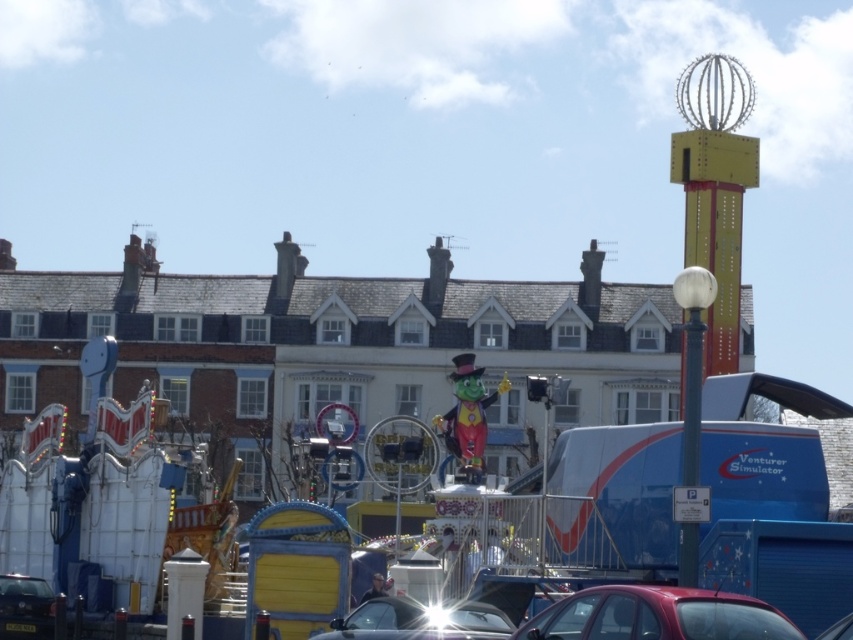
You are a photographer trying to capture a clear shot of the carnival ride in the background. You have two cars in your frame, the shiny red car at lower right and the shiny black car at center. Which car should you move to get a better view of the ride?

The shiny red car at lower right occupies less space than the shiny black car at center, so moving the shiny black car at center would provide a clearer view of the carnival ride in the background.

You are a photographer trying to capture both the shiny red car at lower right and the shiny black car at lower left in a single wide shot. Based on their sizes in the image, which car would appear closer to the camera?

The shiny red car at lower right appears closer to the camera because it is larger in size than the shiny black car at lower left.